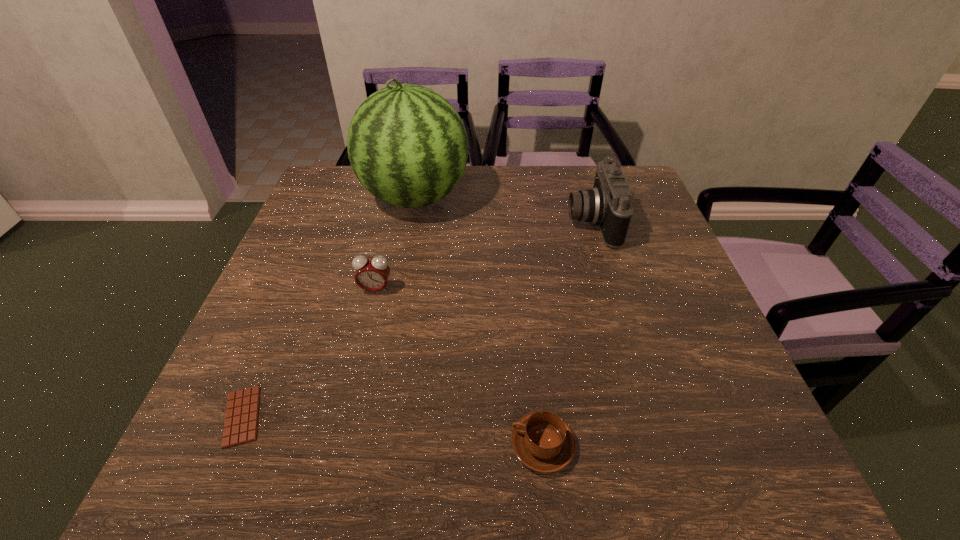
Where is `vacant area at the left edge of the desktop`? This screenshot has width=960, height=540. vacant area at the left edge of the desktop is located at coordinates (349, 220).

I want to click on free space at the right edge, so click(x=691, y=375).

Locate an element on the screen. The height and width of the screenshot is (540, 960). vacant point at the far left corner is located at coordinates (338, 197).

Locate an element on the screen. free space at the near left corner of the desktop is located at coordinates (195, 467).

In the image, there is a desktop. What are the coordinates of `blank space at the far right corner` in the screenshot? It's located at (583, 166).

Locate an element on the screen. The height and width of the screenshot is (540, 960). free area in between the shortest object and the tallest object is located at coordinates (328, 307).

The height and width of the screenshot is (540, 960). Identify the location of empty space between the watermelon and the third farthest object. coord(396,244).

Locate an element on the screen. empty space that is in between the shortest object and the cappuccino is located at coordinates (393, 431).

Find the location of a particular element. free space between the fourth tallest object and the tallest object is located at coordinates (479, 321).

Image resolution: width=960 pixels, height=540 pixels. I want to click on vacant area that lies between the watermelon and the second shortest object, so click(x=479, y=321).